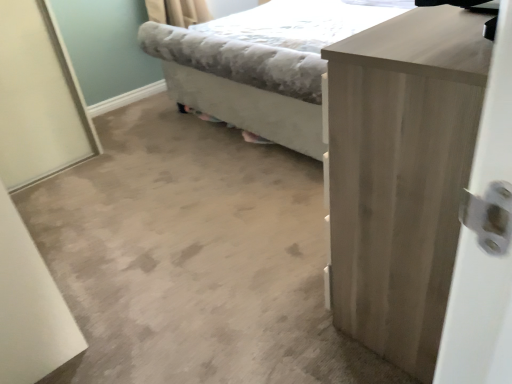
Question: Is light gray fabric bed at center thinner than light wood cabinet at right?

Choices:
 (A) yes
 (B) no

Answer: (B)

Question: From the image's perspective, is light gray fabric bed at center located above light wood cabinet at right?

Choices:
 (A) yes
 (B) no

Answer: (A)

Question: Is light gray fabric bed at center taller than light wood cabinet at right?

Choices:
 (A) yes
 (B) no

Answer: (B)

Question: Is light gray fabric bed at center not near light wood cabinet at right?

Choices:
 (A) no
 (B) yes

Answer: (B)

Question: Considering the relative positions of light gray fabric bed at center and light wood cabinet at right in the image provided, is light gray fabric bed at center behind light wood cabinet at right?

Choices:
 (A) yes
 (B) no

Answer: (A)

Question: Is light wood cabinet at right located within light gray fabric bed at center?

Choices:
 (A) no
 (B) yes

Answer: (A)

Question: Is light wood cabinet at right wider than light gray fabric bed at center?

Choices:
 (A) yes
 (B) no

Answer: (B)

Question: From the image's perspective, is light wood cabinet at right located above light gray fabric bed at center?

Choices:
 (A) no
 (B) yes

Answer: (A)

Question: Is light gray fabric bed at center inside light wood cabinet at right?

Choices:
 (A) no
 (B) yes

Answer: (A)

Question: From a real-world perspective, is light wood cabinet at right physically below light gray fabric bed at center?

Choices:
 (A) yes
 (B) no

Answer: (B)

Question: Are light wood cabinet at right and light gray fabric bed at center located far from each other?

Choices:
 (A) yes
 (B) no

Answer: (A)

Question: From the image's perspective, does light wood cabinet at right appear lower than light gray fabric bed at center?

Choices:
 (A) no
 (B) yes

Answer: (B)

Question: Is light gray fabric bed at center spatially inside light wood cabinet at right, or outside of it?

Choices:
 (A) outside
 (B) inside

Answer: (A)